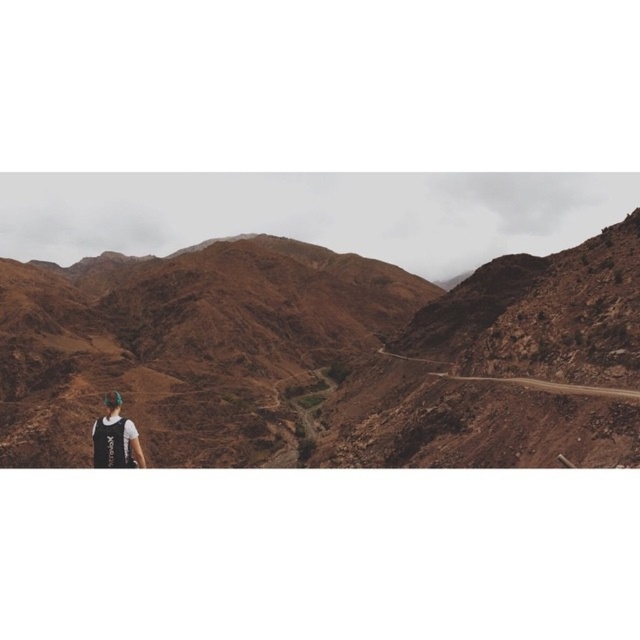
You are standing at the point labeled point (433, 394) and want to walk towards the mountains in the distance. There is another point labeled point (449, 378) ahead of you. Which point is closer to your current position?

Point (433, 394) is closer to the viewer than point (449, 378), so the point labeled point (433, 394) is your current position and the other point is further away.

You are planning a hiking trip and see the black fabric backpack at lower left and the dirt road at center in the image. Which object is larger in size?

The black fabric backpack at lower left is bigger than the dirt road at center.

You are hiking in the mountainous area and see the black fabric backpack at lower left and the dirt road at center. Which object is closer to you, the hiker?

The black fabric backpack at lower left is closer to you because it is positioned in front of the dirt road at center.